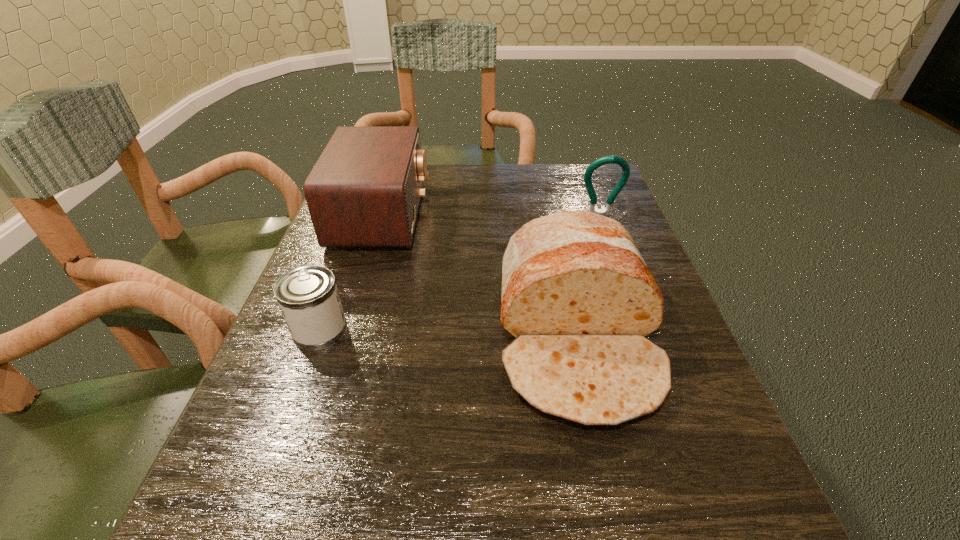
The height and width of the screenshot is (540, 960). In order to click on can present at the left edge in this screenshot , I will do `click(308, 297)`.

Locate an element on the screen. This screenshot has height=540, width=960. bread that is positioned at the right edge is located at coordinates tap(577, 296).

Where is `bottle opener at the right edge`? The width and height of the screenshot is (960, 540). bottle opener at the right edge is located at coordinates (620, 161).

Locate an element on the screen. The width and height of the screenshot is (960, 540). object present at the far left corner is located at coordinates (364, 191).

Where is `free space at the far edge`? Image resolution: width=960 pixels, height=540 pixels. free space at the far edge is located at coordinates (530, 200).

Identify the location of free point at the left edge. pyautogui.click(x=302, y=375).

Where is `free region at the right edge`? The height and width of the screenshot is (540, 960). free region at the right edge is located at coordinates (706, 467).

Where is `vacant space at the near right corner of the desktop`? vacant space at the near right corner of the desktop is located at coordinates (701, 524).

Locate an element on the screen. The image size is (960, 540). vacant area that lies between the shortest object and the radio receiver is located at coordinates (351, 273).

The height and width of the screenshot is (540, 960). What are the coordinates of `empty space that is in between the shortest object and the radio receiver` in the screenshot? It's located at (351, 273).